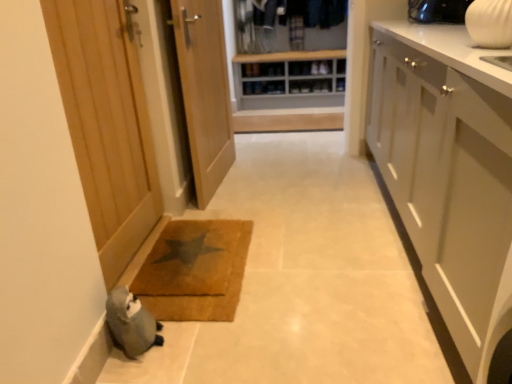
Question: In which direction should I rotate to look at wooden door at center, marked as the second door in a left-to-right arrangement?

Choices:
 (A) left
 (B) right

Answer: (A)

Question: Is wooden door at left, the second door from the right, outside of wooden door at center, marked as the second door in a left-to-right arrangement?

Choices:
 (A) yes
 (B) no

Answer: (A)

Question: From the image's perspective, is wooden door at left, which appears as the first door when viewed from the left, located above wooden door at center, marked as the second door in a left-to-right arrangement?

Choices:
 (A) yes
 (B) no

Answer: (B)

Question: Is wooden door at left, the second door from the right, wider than wooden door at center, marked as the second door in a left-to-right arrangement?

Choices:
 (A) no
 (B) yes

Answer: (A)

Question: Is wooden door at left, the second door from the right, facing away from wooden door at center, marked as the second door in a left-to-right arrangement?

Choices:
 (A) yes
 (B) no

Answer: (B)

Question: From a real-world perspective, is wooden door at left, the second door from the right, below wooden door at center, marked as the second door in a left-to-right arrangement?

Choices:
 (A) yes
 (B) no

Answer: (B)

Question: Is wooden door at left, the second door from the right, bigger than wooden door at center, which is counted as the first door, starting from the right?

Choices:
 (A) yes
 (B) no

Answer: (B)

Question: From a real-world perspective, is braided brown mat at lower center positioned under wooden door at center, marked as the second door in a left-to-right arrangement, based on gravity?

Choices:
 (A) no
 (B) yes

Answer: (B)

Question: Does braided brown mat at lower center appear on the left side of wooden door at center, marked as the second door in a left-to-right arrangement?

Choices:
 (A) yes
 (B) no

Answer: (A)

Question: Is wooden door at center, marked as the second door in a left-to-right arrangement, at the back of braided brown mat at lower center?

Choices:
 (A) no
 (B) yes

Answer: (A)

Question: From the image's perspective, would you say braided brown mat at lower center is shown under wooden door at center, which is counted as the first door, starting from the right?

Choices:
 (A) yes
 (B) no

Answer: (A)

Question: Is braided brown mat at lower center touching wooden door at center, marked as the second door in a left-to-right arrangement?

Choices:
 (A) no
 (B) yes

Answer: (A)

Question: Is braided brown mat at lower center smaller than wooden door at center, which is counted as the first door, starting from the right?

Choices:
 (A) yes
 (B) no

Answer: (A)

Question: From the image's perspective, is wooden shoe rack at center on braided brown mat at lower center?

Choices:
 (A) no
 (B) yes

Answer: (B)